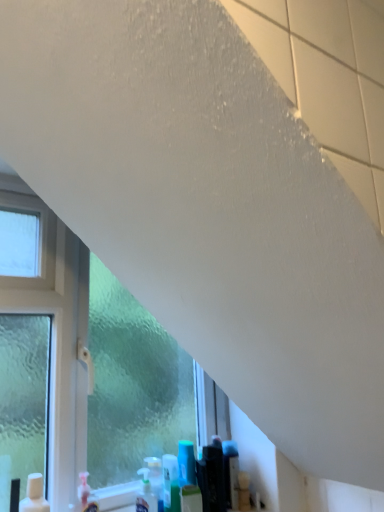
Find the location of `translucent plastic spray bottle at lower center`. translucent plastic spray bottle at lower center is located at coordinates (146, 494).

Measure the distance between translucent plastic spray bottle at lower center and camera.

translucent plastic spray bottle at lower center is 4.18 feet from camera.

What do you see at coordinates (146, 494) in the screenshot?
I see `translucent plastic spray bottle at lower center` at bounding box center [146, 494].

Where is `frosted glass window at left`? Image resolution: width=384 pixels, height=512 pixels. frosted glass window at left is located at coordinates (79, 364).

Describe the element at coordinates (79, 364) in the screenshot. I see `frosted glass window at left` at that location.

Identify the location of translucent plastic spray bottle at lower center. (146, 494).

Which object is positioned more to the right, translucent plastic spray bottle at lower center or frosted glass window at left?

Positioned to the right is translucent plastic spray bottle at lower center.

Does translucent plastic spray bottle at lower center come in front of frosted glass window at left?

No, translucent plastic spray bottle at lower center is further to the viewer.

Between point (146, 471) and point (50, 460), which one is positioned in front?

Positioned in front is point (50, 460).

From the image's perspective, relative to frosted glass window at left, is translucent plastic spray bottle at lower center above or below?

translucent plastic spray bottle at lower center is situated lower than frosted glass window at left in the image.

From a real-world perspective, who is located lower, translucent plastic spray bottle at lower center or frosted glass window at left?

translucent plastic spray bottle at lower center is physically lower.

Can you confirm if translucent plastic spray bottle at lower center is wider than frosted glass window at left?

Incorrect, the width of translucent plastic spray bottle at lower center does not surpass that of frosted glass window at left.

Looking at this image, from their relative heights in the image, would you say translucent plastic spray bottle at lower center is taller or shorter than frosted glass window at left?

Considering their sizes, translucent plastic spray bottle at lower center has less height than frosted glass window at left.

Considering the relative sizes of translucent plastic spray bottle at lower center and frosted glass window at left in the image provided, is translucent plastic spray bottle at lower center smaller than frosted glass window at left?

Yes.

Would you say translucent plastic spray bottle at lower center contains frosted glass window at left?

No, frosted glass window at left is not surrounded by translucent plastic spray bottle at lower center.

Are translucent plastic spray bottle at lower center and frosted glass window at left located far from each other?

No, there isn't a large distance between translucent plastic spray bottle at lower center and frosted glass window at left.

Is frosted glass window at left at the back of translucent plastic spray bottle at lower center?

Yes, translucent plastic spray bottle at lower center is facing away from frosted glass window at left.

Consider the image. Can you tell me how much translucent plastic spray bottle at lower center and frosted glass window at left differ in facing direction?

0.759 degrees separate the facing orientations of translucent plastic spray bottle at lower center and frosted glass window at left.

Could you measure the distance between translucent plastic spray bottle at lower center and frosted glass window at left?

translucent plastic spray bottle at lower center is 37.83 centimeters from frosted glass window at left.

Image resolution: width=384 pixels, height=512 pixels. Find the location of `cleaning product directly beneath the frosted glass window at left (from a real-world perspective)`. cleaning product directly beneath the frosted glass window at left (from a real-world perspective) is located at coordinates (146, 494).

Which object is positioned more to the right, frosted glass window at left or translucent plastic spray bottle at lower center?

translucent plastic spray bottle at lower center.

Is the depth of frosted glass window at left greater than that of translucent plastic spray bottle at lower center?

No, the depth of frosted glass window at left is less than that of translucent plastic spray bottle at lower center.

Is point (90, 457) closer to camera compared to point (147, 490)?

Yes, point (90, 457) is closer to viewer.

From the image's perspective, is frosted glass window at left under translucent plastic spray bottle at lower center?

Actually, frosted glass window at left appears above translucent plastic spray bottle at lower center in the image.

From a real-world perspective, is frosted glass window at left located higher than translucent plastic spray bottle at lower center?

Yes, from a real-world perspective, frosted glass window at left is over translucent plastic spray bottle at lower center

Does frosted glass window at left have a lesser width compared to translucent plastic spray bottle at lower center?

In fact, frosted glass window at left might be wider than translucent plastic spray bottle at lower center.

Considering the sizes of objects frosted glass window at left and translucent plastic spray bottle at lower center in the image provided, who is shorter, frosted glass window at left or translucent plastic spray bottle at lower center?

translucent plastic spray bottle at lower center.

In terms of size, does frosted glass window at left appear bigger or smaller than translucent plastic spray bottle at lower center?

Considering their sizes, frosted glass window at left takes up more space than translucent plastic spray bottle at lower center.

Do you think frosted glass window at left is within translucent plastic spray bottle at lower center, or outside of it?

frosted glass window at left is outside translucent plastic spray bottle at lower center.

Are frosted glass window at left and translucent plastic spray bottle at lower center far apart?

No, frosted glass window at left is in close proximity to translucent plastic spray bottle at lower center.

Is translucent plastic spray bottle at lower center at the back of frosted glass window at left?

That's right, frosted glass window at left is facing away from translucent plastic spray bottle at lower center.

How different are the orientations of frosted glass window at left and translucent plastic spray bottle at lower center in degrees?

0.759 degrees separate the facing orientations of frosted glass window at left and translucent plastic spray bottle at lower center.

I want to click on cleaning product located behind the frosted glass window at left, so click(x=146, y=494).

You are a GUI agent. You are given a task and a screenshot of the screen. Output one action in this format:
    pyautogui.click(x=<x>, y=<y>)
    Task: Click on the window above the translucent plastic spray bottle at lower center (from a real-world perspective)
    The height and width of the screenshot is (512, 384).
    Given the screenshot: What is the action you would take?
    pyautogui.click(x=79, y=364)

The width and height of the screenshot is (384, 512). I want to click on window in front of the translucent plastic spray bottle at lower center, so click(79, 364).